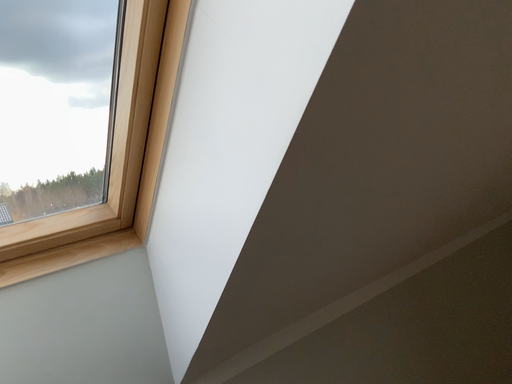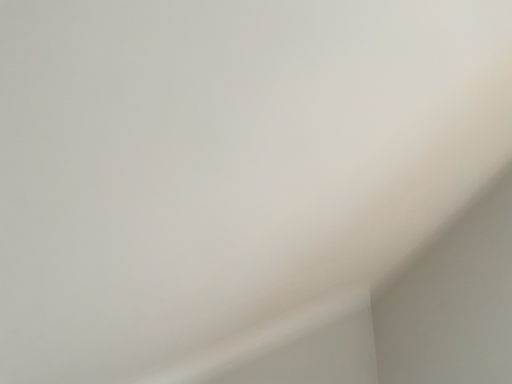
Question: How did the camera likely rotate when shooting the video?

Choices:
 (A) rotated left
 (B) rotated right

Answer: (B)